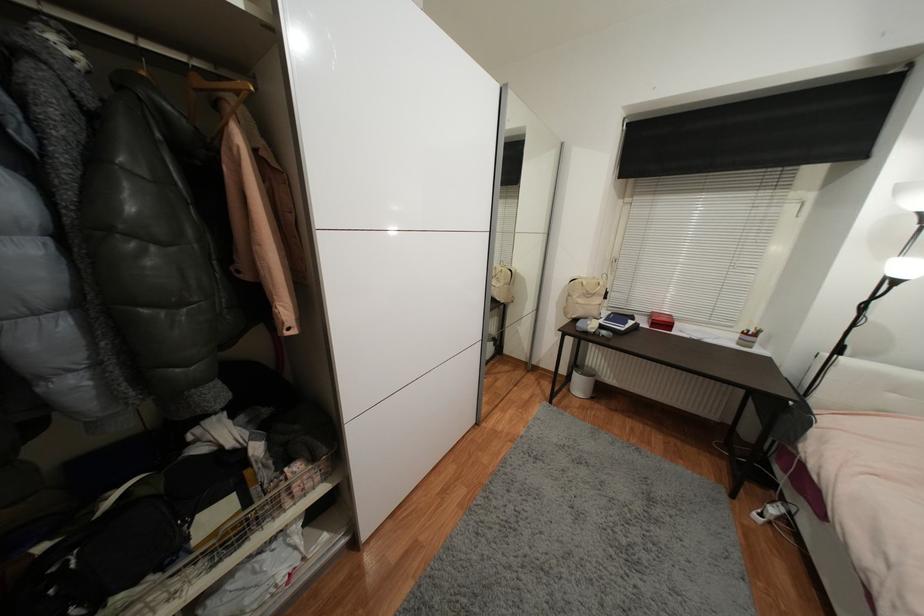
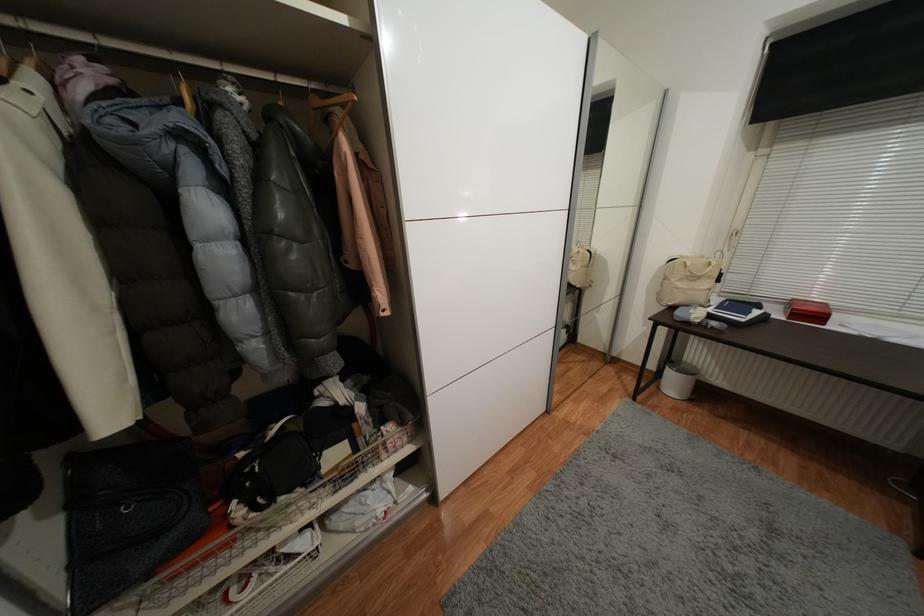
Locate, in the second image, the point that corresponds to pixel 626 330 in the first image.

(747, 321)